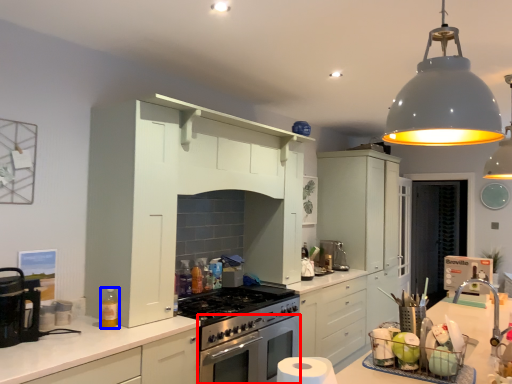
Question: Which of the following is the closest to the observer, oven (highlighted by a red box) or bottle (highlighted by a blue box)?

Choices:
 (A) oven
 (B) bottle

Answer: (B)